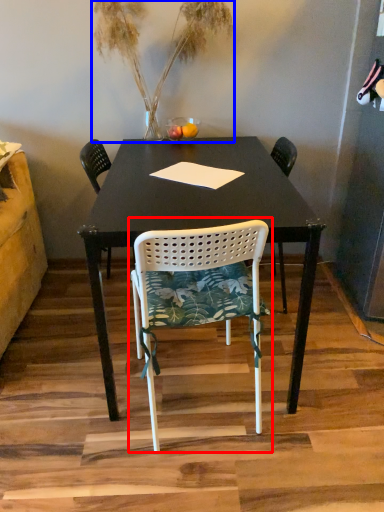
Question: Which object is closer to the camera taking this photo, chair (highlighted by a red box) or houseplant (highlighted by a blue box)?

Choices:
 (A) chair
 (B) houseplant

Answer: (A)